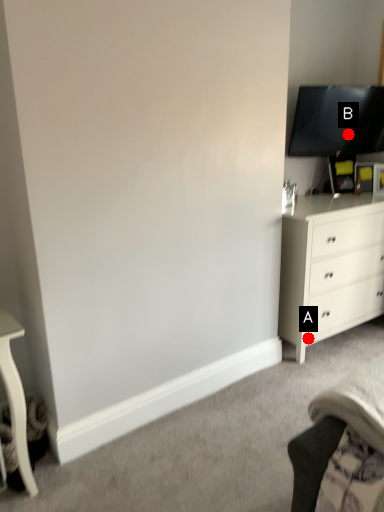
Question: Two points are circled on the image, labeled by A and B beside each circle. Which point is farther from the camera taking this photo?

Choices:
 (A) A is further
 (B) B is further

Answer: (B)